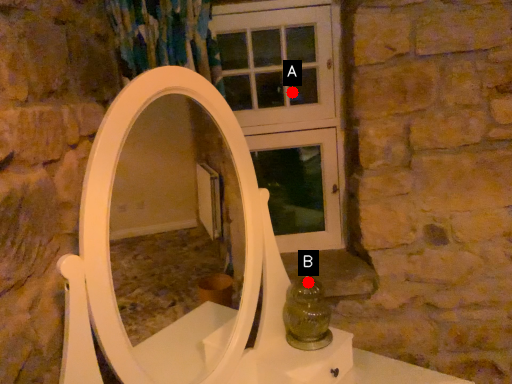
Question: Two points are circled on the image, labeled by A and B beside each circle. Which point is closer to the camera taking this photo?

Choices:
 (A) A is closer
 (B) B is closer

Answer: (B)